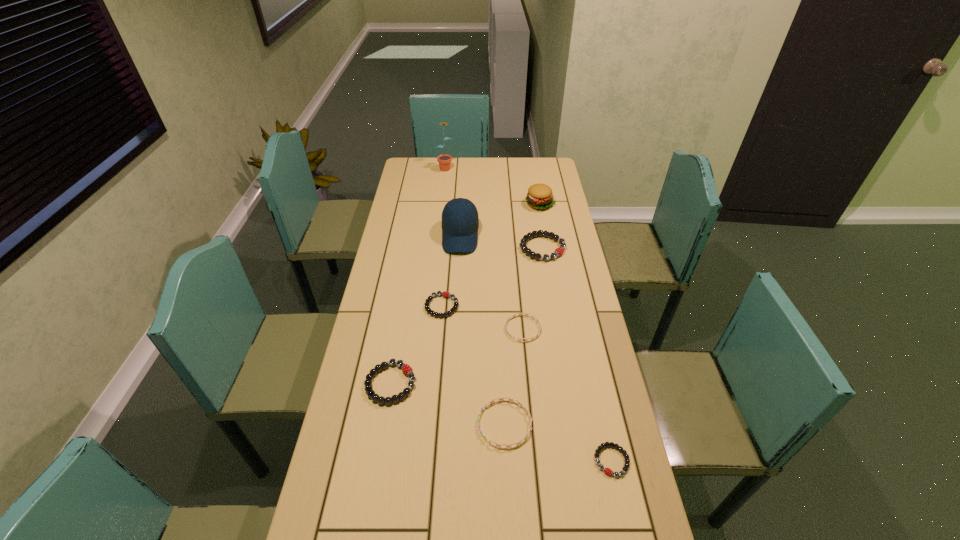
Where is `free space located 0.230m on the surface of the bigger blue bracelet showing star-shaped elements`? Image resolution: width=960 pixels, height=540 pixels. free space located 0.230m on the surface of the bigger blue bracelet showing star-shaped elements is located at coordinates (394, 424).

I want to click on vacant region located on the surface of the bigger blue bracelet showing star-shaped elements, so 452,424.

Find the location of a particular element. The width and height of the screenshot is (960, 540). vacant space situated 0.400m on the front of the second farthest black bracelet is located at coordinates click(x=431, y=430).

The width and height of the screenshot is (960, 540). I want to click on free location located on the surface of the farther blue bracelet showing star-shaped elements, so click(x=420, y=329).

Identify the location of vacant space located on the surface of the farther blue bracelet showing star-shaped elements. The image size is (960, 540). (384, 329).

The width and height of the screenshot is (960, 540). I want to click on vacant area situated 0.390m on the surface of the farther blue bracelet showing star-shaped elements, so click(x=387, y=329).

Where is `vacant space situated 0.170m on the back of the nearest black bracelet`? The width and height of the screenshot is (960, 540). vacant space situated 0.170m on the back of the nearest black bracelet is located at coordinates (595, 388).

You are a GUI agent. You are given a task and a screenshot of the screen. Output one action in this format:
    pyautogui.click(x=<x>, y=<y>)
    Task: Click on the object that is at the far edge
    
    Given the screenshot: What is the action you would take?
    pyautogui.click(x=444, y=160)

The width and height of the screenshot is (960, 540). Find the location of `sunflower located in the left edge section of the desktop`. sunflower located in the left edge section of the desktop is located at coordinates (444, 160).

Where is `bracelet positioned at the left edge`? The width and height of the screenshot is (960, 540). bracelet positioned at the left edge is located at coordinates (406, 369).